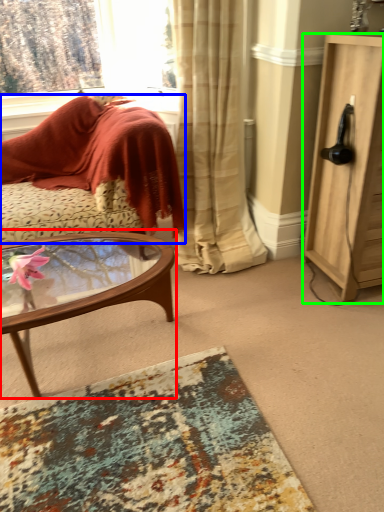
Question: Based on their relative distances, which object is farther from coffee table (highlighted by a red box)? Choose from cushion (highlighted by a blue box) and cabinetry (highlighted by a green box).

Choices:
 (A) cushion
 (B) cabinetry

Answer: (B)